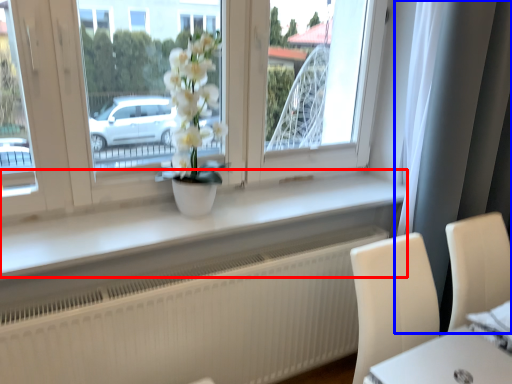
Question: Among these objects, which one is farthest to the camera, window sill (highlighted by a red box) or curtain (highlighted by a blue box)?

Choices:
 (A) window sill
 (B) curtain

Answer: (B)